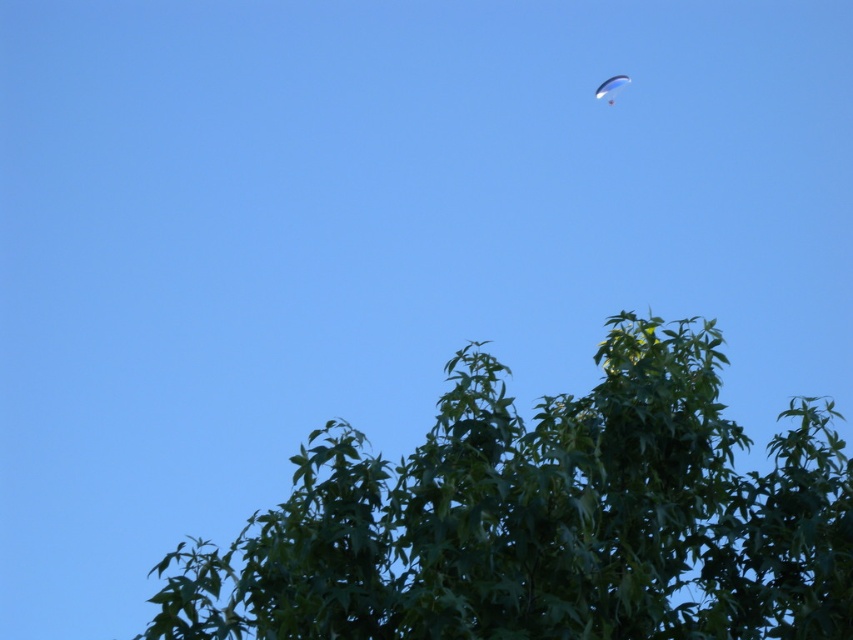
Question: Does green leafy tree at center have a lesser width compared to white glossy parachute at upper right?

Choices:
 (A) yes
 (B) no

Answer: (B)

Question: Considering the relative positions of green leafy tree at center and white glossy parachute at upper right in the image provided, where is green leafy tree at center located with respect to white glossy parachute at upper right?

Choices:
 (A) above
 (B) below

Answer: (B)

Question: Is green leafy tree at center wider than white glossy parachute at upper right?

Choices:
 (A) no
 (B) yes

Answer: (B)

Question: Among these points, which one is farthest from the camera?

Choices:
 (A) (490, 460)
 (B) (628, 83)

Answer: (B)